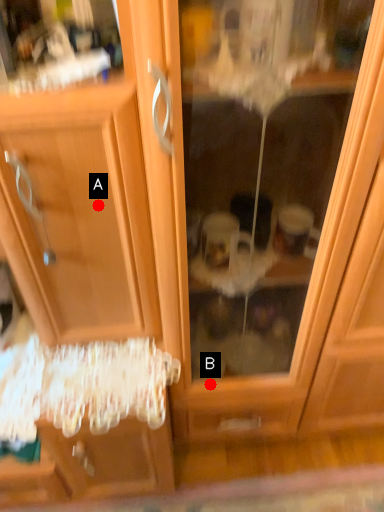
Question: Two points are circled on the image, labeled by A and B beside each circle. Which point appears closest to the camera in this image?

Choices:
 (A) A is closer
 (B) B is closer

Answer: (A)